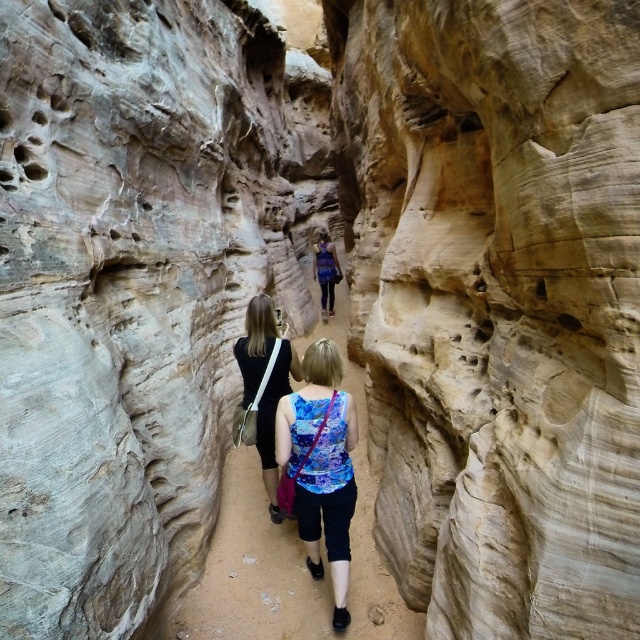
You are hiking through the canyon and notice the smooth sandstone trail at center and the floral tank top at center. Which object is positioned lower in the image?

The smooth sandstone trail at center is located below the floral tank top at center, so it is positioned lower in the image.

You are planning to cross the canyon and need to choose between the smooth beige rock at center and the smooth sandstone trail at center. Which option is wider for a safer crossing?

The smooth sandstone trail at center is wider than the smooth beige rock at center, so it would be the safer choice for crossing.